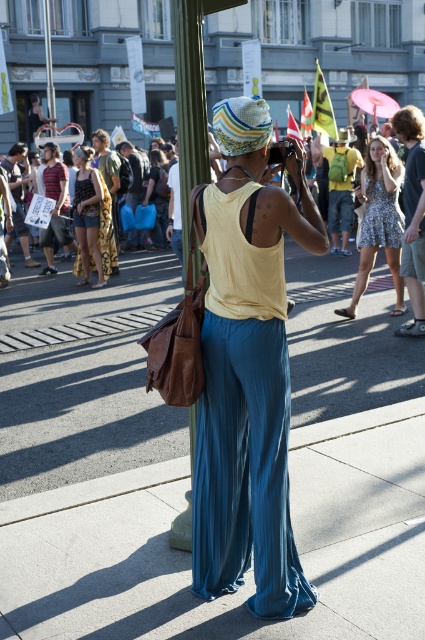
Question: Can you confirm if matte black tank top at center is wider than matte yellow tank top at center?

Choices:
 (A) yes
 (B) no

Answer: (A)

Question: Does matte black tank top at center appear on the right side of matte yellow tank top at center?

Choices:
 (A) yes
 (B) no

Answer: (B)

Question: Does dusty blue dress at center have a greater width compared to matte black tank top at center?

Choices:
 (A) yes
 (B) no

Answer: (A)

Question: Which of the following is the closest to the observer?

Choices:
 (A) (255, 513)
 (B) (90, 236)
 (C) (130, 358)
 (D) (388, 202)

Answer: (A)

Question: Which object is positioned farthest from the matte yellow tank top at center?

Choices:
 (A) matte black tank top at center
 (B) blue fabric pants at center

Answer: (B)

Question: Which object is farther from the camera taking this photo?

Choices:
 (A) dusty blue dress at center
 (B) blue fabric pants at center
 (C) blue pleated pants at center
 (D) matte yellow tank top at center

Answer: (D)